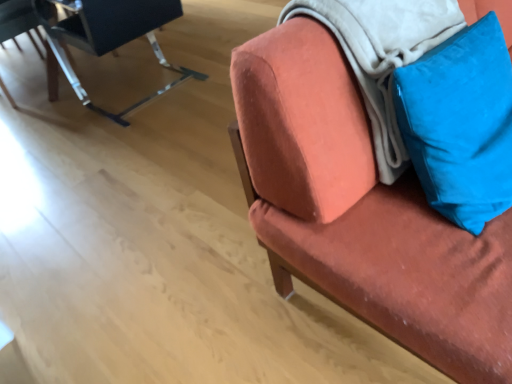
Where is `vacant area that is situated to the right of metallic black chair at upper left, the 3th chair positioned from the right`? vacant area that is situated to the right of metallic black chair at upper left, the 3th chair positioned from the right is located at coordinates (102, 65).